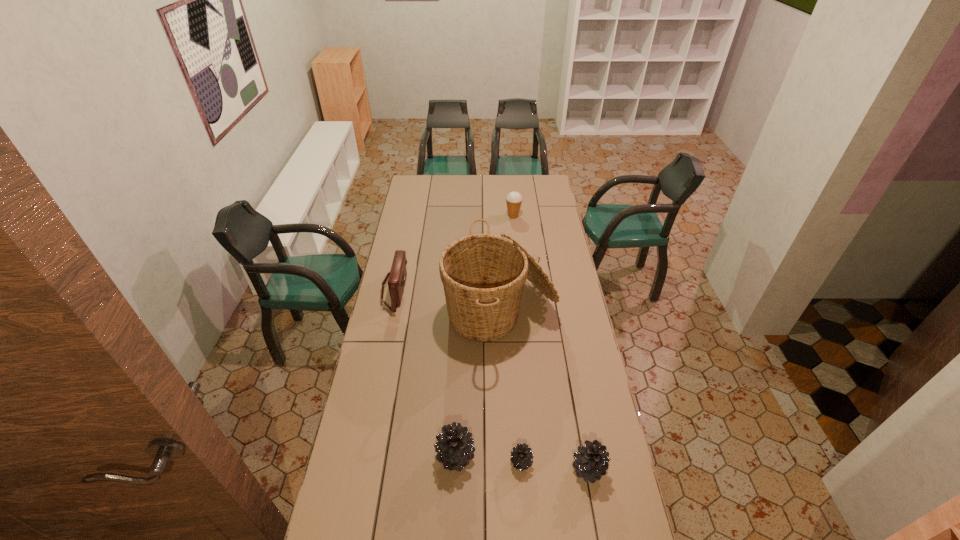
Locate an element on the screen. The image size is (960, 540). vacant space situated 0.170m on the back of the icecream is located at coordinates (512, 196).

Where is `vacant area situated on the back of the basket`? This screenshot has width=960, height=540. vacant area situated on the back of the basket is located at coordinates (496, 233).

Locate an element on the screen. This screenshot has width=960, height=540. vacant space positioned 0.380m on the front flap of the shoulder bag is located at coordinates (487, 290).

Locate an element on the screen. This screenshot has width=960, height=540. object that is at the left edge is located at coordinates (397, 276).

This screenshot has width=960, height=540. In order to click on pinecone that is at the right edge in this screenshot , I will do `click(591, 463)`.

The width and height of the screenshot is (960, 540). Identify the location of basket that is positioned at the right edge. (483, 275).

The width and height of the screenshot is (960, 540). In order to click on vacant space at the left edge in this screenshot , I will do `click(417, 230)`.

This screenshot has height=540, width=960. In the image, there is a desktop. Find the location of `vacant space at the right edge`. vacant space at the right edge is located at coordinates (575, 286).

Locate an element on the screen. The width and height of the screenshot is (960, 540). blank space at the far right corner of the desktop is located at coordinates (540, 187).

Where is `empty location between the shortest object and the farthest object`? The height and width of the screenshot is (540, 960). empty location between the shortest object and the farthest object is located at coordinates (517, 339).